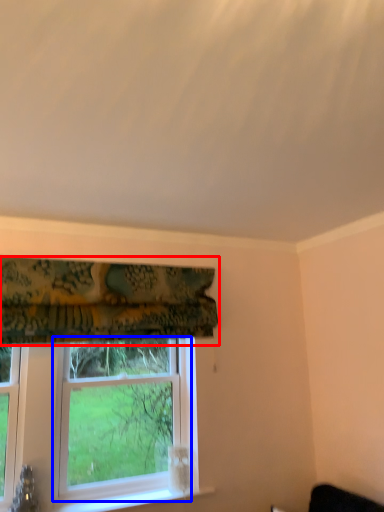
Question: Which of the following is the farthest to the observer, curtain (highlighted by a red box) or window (highlighted by a blue box)?

Choices:
 (A) curtain
 (B) window

Answer: (B)